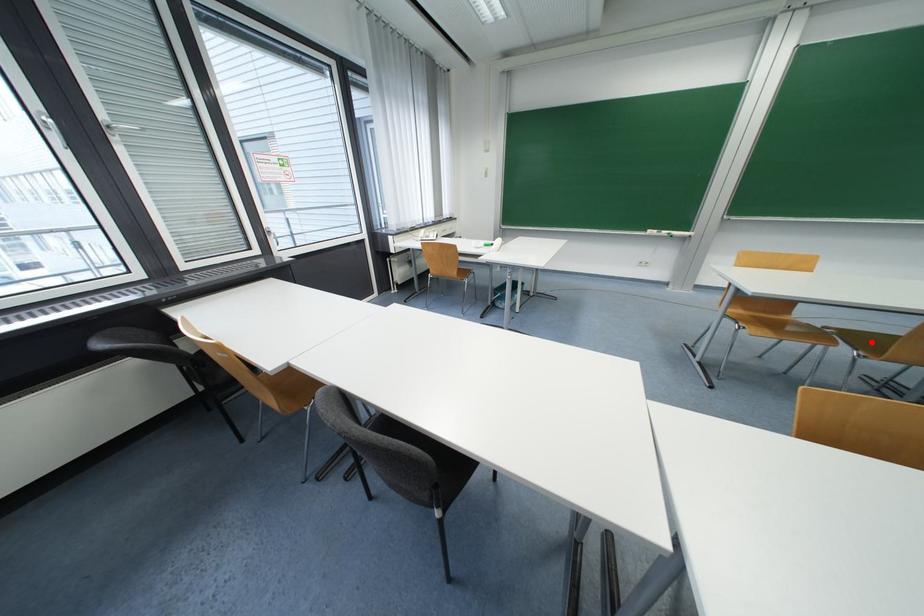
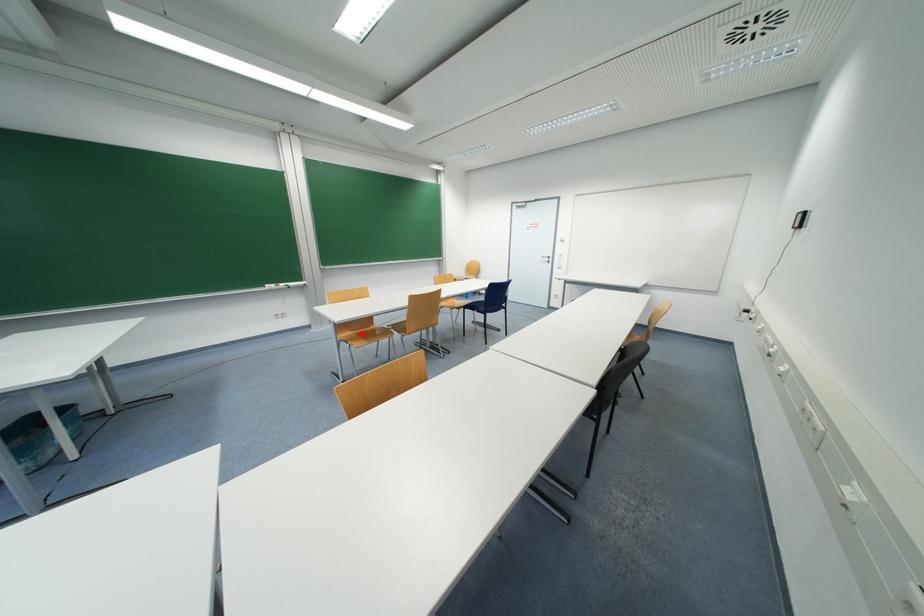
I am providing you with two images of the same scene from different viewpoints. A red point is marked on the first image and another point is marked on the second image. Do the highlighted points in image1 and image2 indicate the same real-world spot?

No